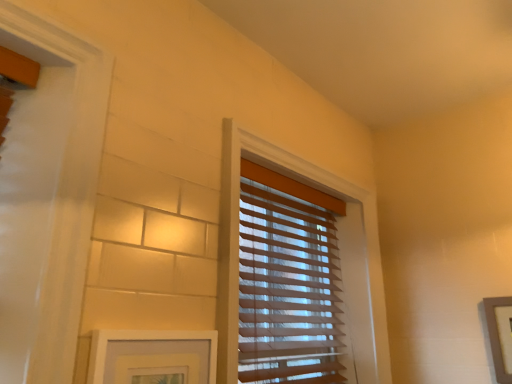
Question: Should I look upward or downward to see translucent wood blinds at center?

Choices:
 (A) down
 (B) up

Answer: (A)

Question: Does translucent wood blinds at center have a smaller size compared to wooden picture frame at right, placed as the first picture frame when sorted from right to left?

Choices:
 (A) yes
 (B) no

Answer: (B)

Question: From the image's perspective, does translucent wood blinds at center appear lower than wooden picture frame at right, which is the 2th picture frame in front-to-back order?

Choices:
 (A) no
 (B) yes

Answer: (A)

Question: Is translucent wood blinds at center positioned before wooden picture frame at right, which is counted as the second picture frame, starting from the left?

Choices:
 (A) no
 (B) yes

Answer: (B)

Question: Would you say translucent wood blinds at center is a long distance from wooden picture frame at right, which is counted as the second picture frame, starting from the left?

Choices:
 (A) no
 (B) yes

Answer: (A)

Question: Is translucent wood blinds at center looking in the opposite direction of wooden picture frame at right, which is the 2th picture frame in front-to-back order?

Choices:
 (A) yes
 (B) no

Answer: (B)

Question: Does translucent wood blinds at center have a lesser width compared to wooden picture frame at right, which is counted as the second picture frame, starting from the left?

Choices:
 (A) no
 (B) yes

Answer: (A)

Question: Can you confirm if white matte picture frame at lower left, the 2th picture frame when ordered from back to front, is smaller than translucent wood blinds at center?

Choices:
 (A) no
 (B) yes

Answer: (B)

Question: Is white matte picture frame at lower left, which appears as the 1th picture frame when viewed from the left, not within translucent wood blinds at center?

Choices:
 (A) yes
 (B) no

Answer: (A)

Question: From a real-world perspective, is white matte picture frame at lower left, the 2th picture frame when ordered from back to front, physically above translucent wood blinds at center?

Choices:
 (A) yes
 (B) no

Answer: (B)

Question: Does white matte picture frame at lower left, the first picture frame viewed from the front, turn towards translucent wood blinds at center?

Choices:
 (A) yes
 (B) no

Answer: (B)

Question: Considering the relative positions of white matte picture frame at lower left, the 2th picture frame viewed from the right, and translucent wood blinds at center in the image provided, is white matte picture frame at lower left, the 2th picture frame viewed from the right, to the right of translucent wood blinds at center from the viewer's perspective?

Choices:
 (A) no
 (B) yes

Answer: (A)

Question: Is white matte picture frame at lower left, the first picture frame viewed from the front, placed right next to translucent wood blinds at center?

Choices:
 (A) yes
 (B) no

Answer: (B)

Question: From the image's perspective, is wooden picture frame at right, which is counted as the first picture frame, starting from the back, on top of white matte picture frame at lower left, the 2th picture frame when ordered from back to front?

Choices:
 (A) yes
 (B) no

Answer: (B)